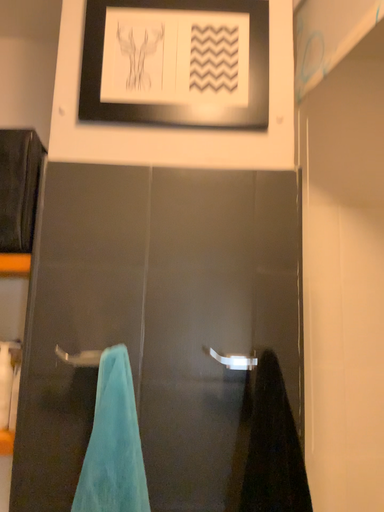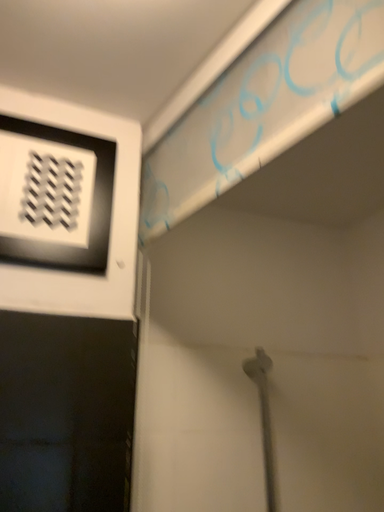
Question: Which way did the camera rotate in the video?

Choices:
 (A) rotated downward
 (B) rotated upward

Answer: (B)